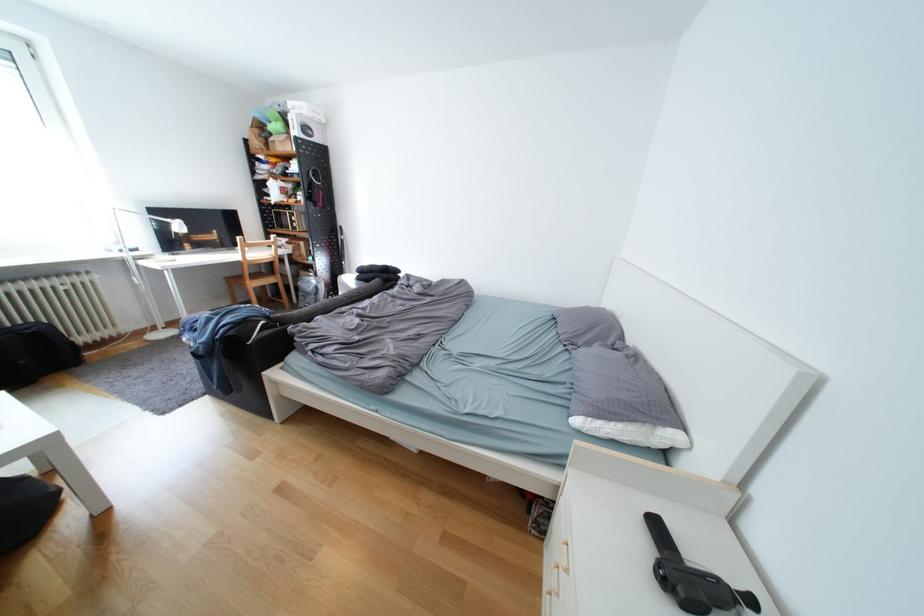
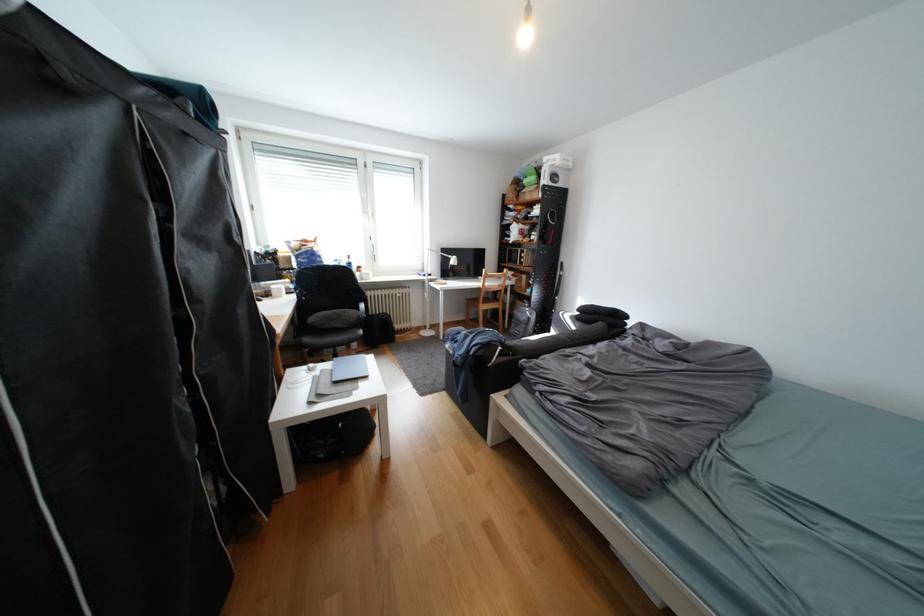
Question: The camera is either moving clockwise (left) or counter-clockwise (right) around the object. The first image is from the beginning of the video and the second image is from the end. Is the camera moving left or right when shooting the video?

Choices:
 (A) Left
 (B) Right

Answer: (B)